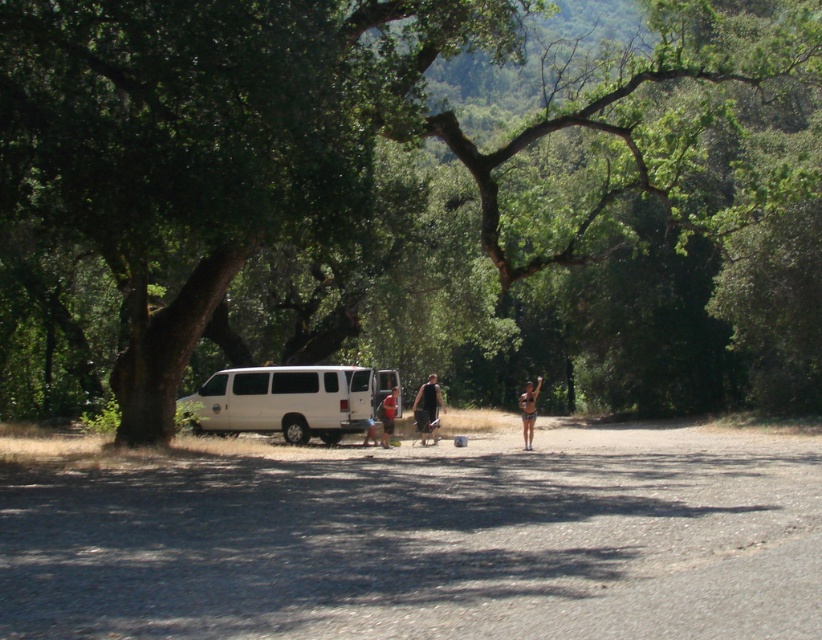
From the picture: You are standing at the edge of the path in the serene outdoor scene. There are two points marked in the image. Which point, point [252,410] or point [439,400], is closer to you?

Point [252,410] is closer to the viewer than point [439,400].

You are planning to take a walk along the path in the park and notice the white matte van at center and the black fabric shorts at center. Which object takes up more space in the image?

The black fabric shorts at center occupies more space than the white matte van at center because the white matte van at center occupies less space than black fabric shorts at center.